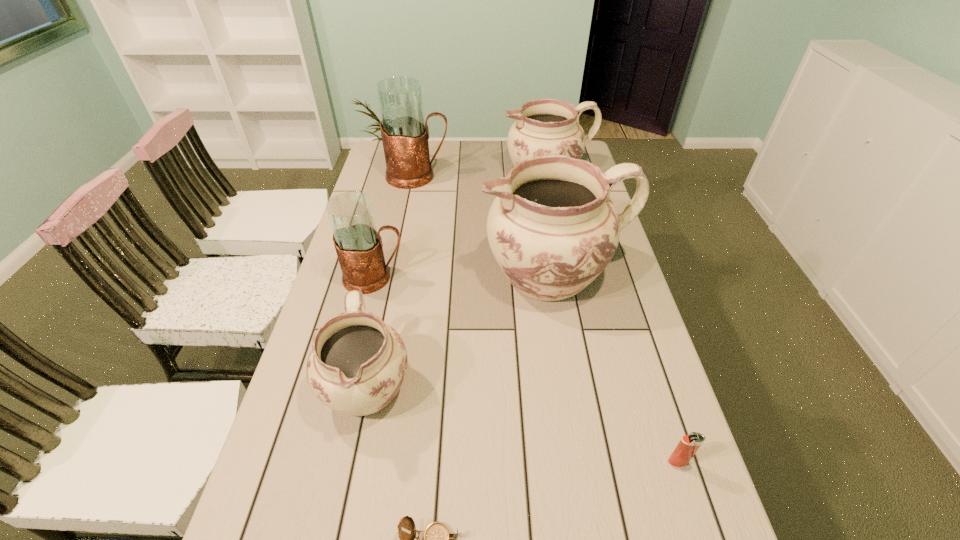
Find the location of `the bigger gray pitcher`. the bigger gray pitcher is located at coordinates (405, 133).

The height and width of the screenshot is (540, 960). Identify the location of the second nearest purple pitcher. (552, 228).

This screenshot has height=540, width=960. Find the location of `the second biggest purple pitcher`. the second biggest purple pitcher is located at coordinates (547, 126).

Identify the location of the smaller gray pitcher. (359, 247).

In order to click on the third nearest object in this screenshot , I will do `click(357, 364)`.

Image resolution: width=960 pixels, height=540 pixels. I want to click on the leftmost purple pitcher, so click(357, 364).

The height and width of the screenshot is (540, 960). What are the coordinates of `the sixth tallest object` in the screenshot? It's located at (689, 444).

Find the location of a particular element. This screenshot has height=540, width=960. igniter is located at coordinates (689, 444).

At what (x,y) coordinates should I click in order to perform the action: click on vacant area situated with the handle on the side of the farther gray pitcher. Please return your answer as a coordinate pair (x, y). This screenshot has width=960, height=540. Looking at the image, I should click on (542, 176).

Where is `vacant space located on the spout of the second nearest purple pitcher`? The image size is (960, 540). vacant space located on the spout of the second nearest purple pitcher is located at coordinates (461, 275).